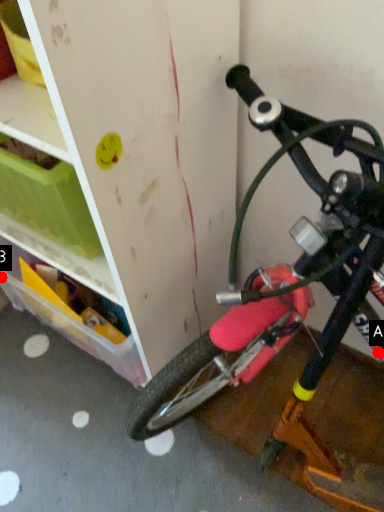
Question: Two points are circled on the image, labeled by A and B beside each circle. Which point appears closest to the camera in this image?

Choices:
 (A) A is closer
 (B) B is closer

Answer: (A)